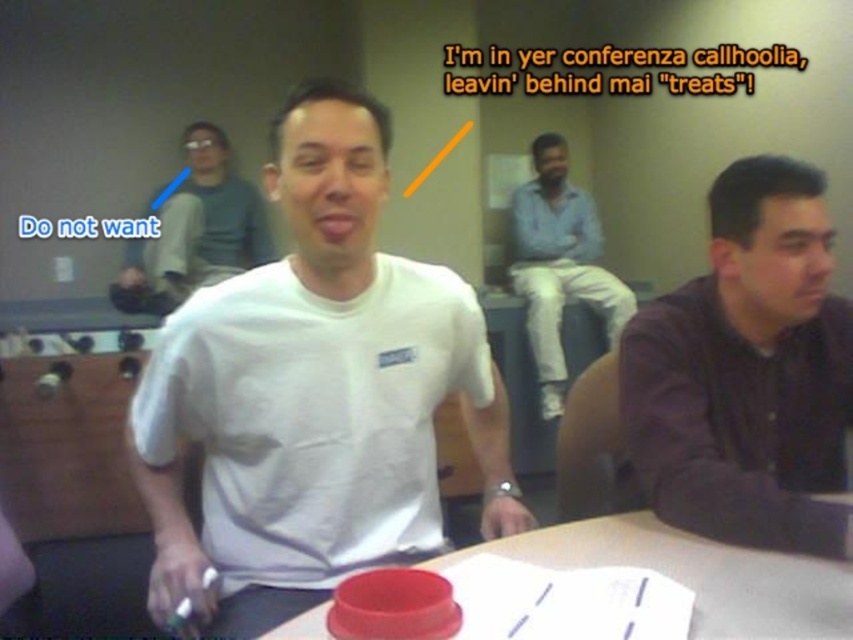
Describe the element at coordinates (747, 372) in the screenshot. I see `dark purple shirt at right` at that location.

Who is higher up, dark purple shirt at right or smooth plastic lid at center?

dark purple shirt at right is above.

You are a GUI agent. You are given a task and a screenshot of the screen. Output one action in this format:
    pyautogui.click(x=<x>, y=<y>)
    Task: Click on the dark purple shirt at right
    The width and height of the screenshot is (853, 640).
    Given the screenshot: What is the action you would take?
    pyautogui.click(x=747, y=372)

Where is `dark purple shirt at right`? This screenshot has height=640, width=853. dark purple shirt at right is located at coordinates (747, 372).

Is white matte t-shirt at center wider than dark purple shirt at right?

Correct, the width of white matte t-shirt at center exceeds that of dark purple shirt at right.

Locate an element on the screen. The image size is (853, 640). white matte t-shirt at center is located at coordinates (314, 392).

What do you see at coordinates (314, 392) in the screenshot? I see `white matte t-shirt at center` at bounding box center [314, 392].

Find the location of a particular element. The width and height of the screenshot is (853, 640). white matte t-shirt at center is located at coordinates (314, 392).

Can you confirm if white matte t-shirt at center is positioned above matte white t-shirt at center?

No, white matte t-shirt at center is not above matte white t-shirt at center.

You are a GUI agent. You are given a task and a screenshot of the screen. Output one action in this format:
    pyautogui.click(x=<x>, y=<y>)
    Task: Click on the white matte t-shirt at center
    The image size is (853, 640).
    Given the screenshot: What is the action you would take?
    pyautogui.click(x=314, y=392)

Is point (279, 148) positioned after point (228, 225)?

No, it is not.

Find the location of a particular element. The width and height of the screenshot is (853, 640). white matte t-shirt at center is located at coordinates (314, 392).